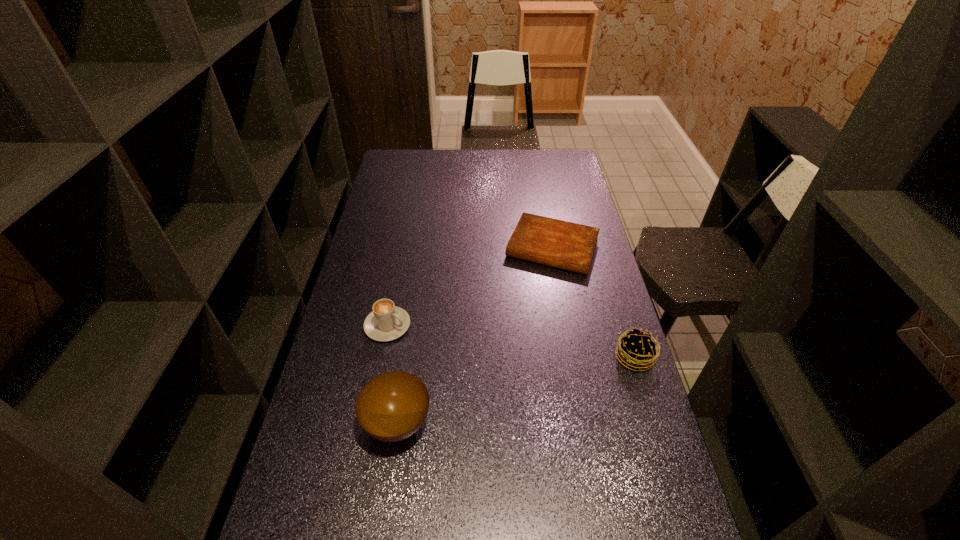
The width and height of the screenshot is (960, 540). Identify the location of free space between the cappuccino and the farthest object. (469, 287).

The width and height of the screenshot is (960, 540). Identify the location of free area in between the bowl and the patty. [516, 390].

Find the location of `object identified as the closest to the patty`. object identified as the closest to the patty is located at coordinates (570, 246).

The image size is (960, 540). I want to click on object that is the second closest to the patty, so click(391, 407).

Where is `free space that satisfies the following two spatial constraints: 1. on the front side of the bowl; 2. on the right side of the cappuccino`? free space that satisfies the following two spatial constraints: 1. on the front side of the bowl; 2. on the right side of the cappuccino is located at coordinates (369, 423).

Locate an element on the screen. This screenshot has height=540, width=960. vacant space that satisfies the following two spatial constraints: 1. on the back side of the cappuccino; 2. on the left side of the Bible is located at coordinates point(402,248).

I want to click on vacant space that satisfies the following two spatial constraints: 1. on the front side of the bowl; 2. on the right side of the cappuccino, so click(x=369, y=423).